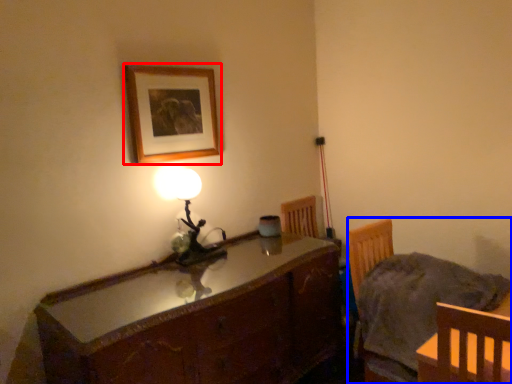
Question: Among these objects, which one is nearest to the camera, picture frame (highlighted by a red box) or chair (highlighted by a blue box)?

Choices:
 (A) picture frame
 (B) chair

Answer: (B)